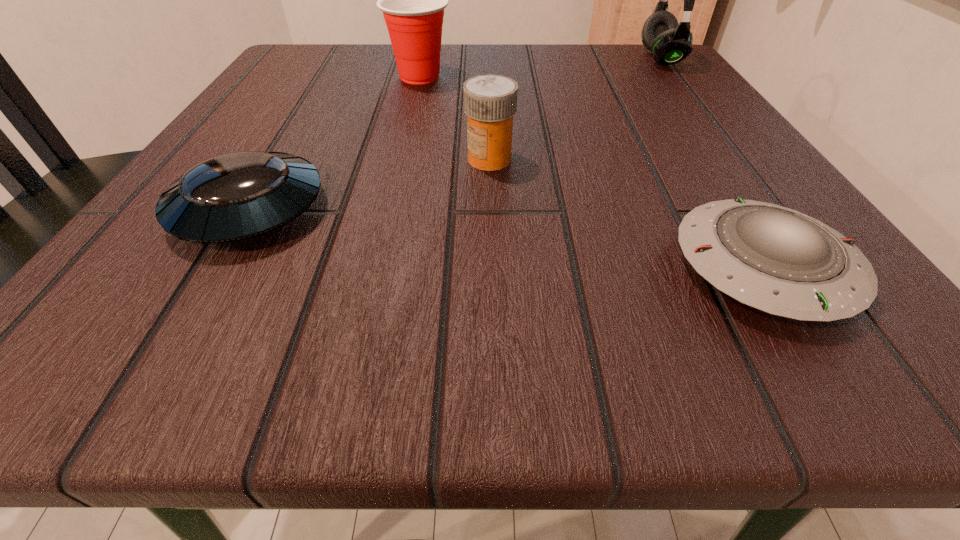
Image resolution: width=960 pixels, height=540 pixels. Find the location of `vacant space that's between the second shortest object and the third tallest object`. vacant space that's between the second shortest object and the third tallest object is located at coordinates (370, 184).

What are the coordinates of `object that can be found as the second closest to the medicine` in the screenshot? It's located at [777, 260].

The width and height of the screenshot is (960, 540). Identify the location of object identified as the closest to the medicine. (235, 196).

Locate an element on the screen. free space in the image that satisfies the following two spatial constraints: 1. on the back side of the left saucer; 2. on the left side of the cup is located at coordinates (328, 77).

The height and width of the screenshot is (540, 960). Find the location of `vacant space that satisfies the following two spatial constraints: 1. on the label side of the medicine; 2. on the left side of the right saucer`. vacant space that satisfies the following two spatial constraints: 1. on the label side of the medicine; 2. on the left side of the right saucer is located at coordinates click(x=492, y=267).

Locate an element on the screen. free spot that satisfies the following two spatial constraints: 1. on the label side of the shorter saucer; 2. on the right side of the medicine is located at coordinates (492, 267).

This screenshot has width=960, height=540. What are the coordinates of `free location that satisfies the following two spatial constraints: 1. on the ear cups of the tallest object; 2. on the front side of the right saucer` in the screenshot? It's located at (818, 267).

Identify the location of free location that satisfies the following two spatial constraints: 1. on the label side of the third shortest object; 2. on the right side of the right saucer. This screenshot has width=960, height=540. (492, 267).

Locate an element on the screen. Image resolution: width=960 pixels, height=540 pixels. vacant space that satisfies the following two spatial constraints: 1. on the label side of the shorter saucer; 2. on the left side of the third tallest object is located at coordinates (492, 267).